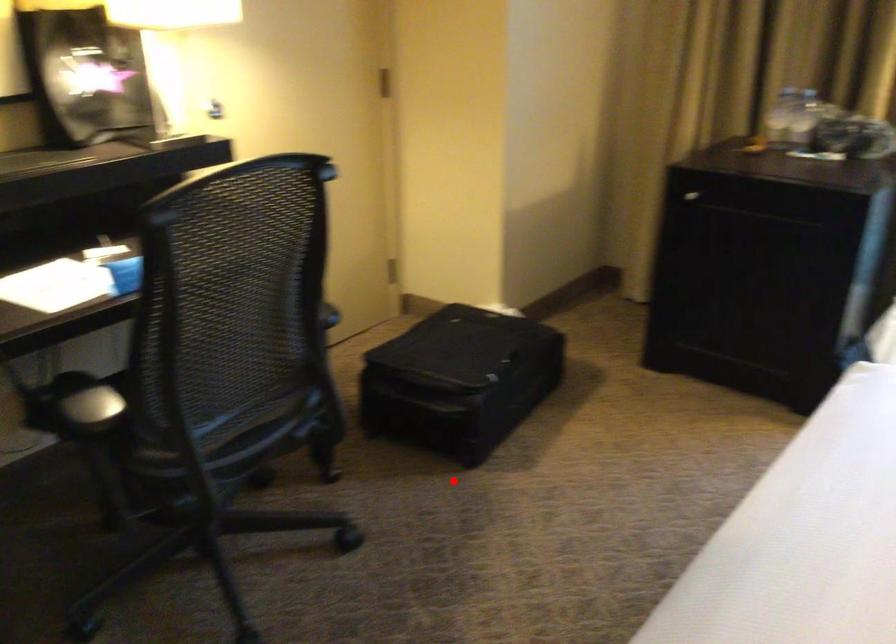
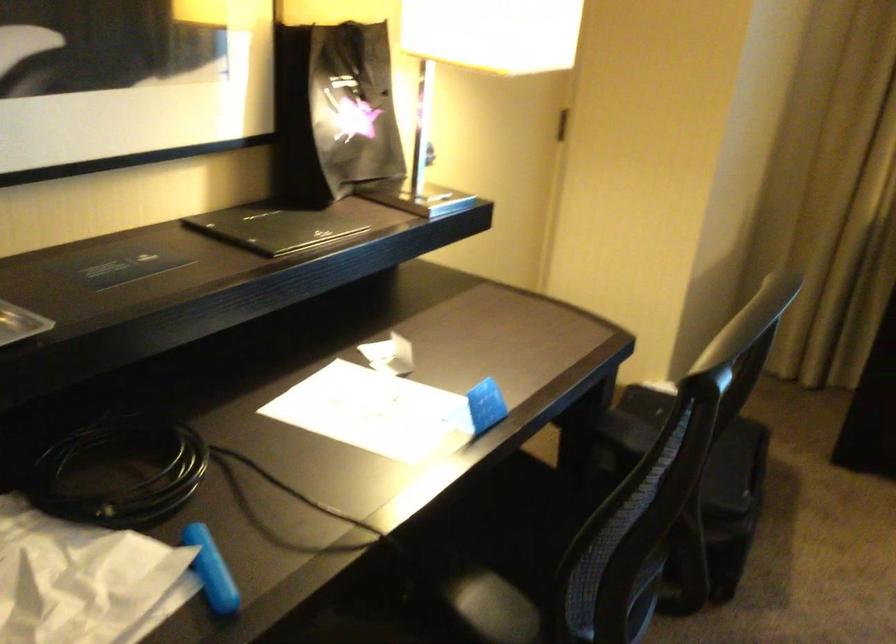
Find the pixel in the second image that matches the highlighted location in the first image.

(709, 618)